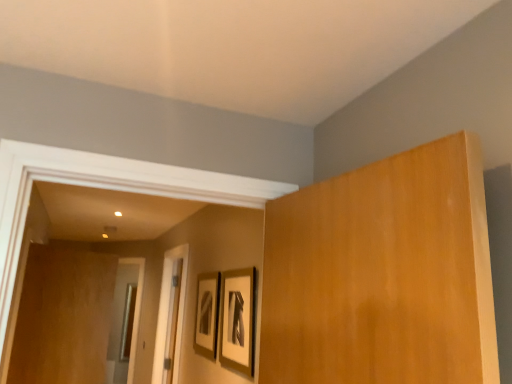
Question: Is matte black picture frame at center, the 2th picture frame when ordered from right to left, surrounded by brown wood door at left?

Choices:
 (A) yes
 (B) no

Answer: (B)

Question: Considering the relative positions of brown wood door at left and matte black picture frame at center, the 2th picture frame when ordered from right to left, in the image provided, is brown wood door at left to the left of matte black picture frame at center, the 2th picture frame when ordered from right to left, from the viewer's perspective?

Choices:
 (A) no
 (B) yes

Answer: (B)

Question: Can you confirm if brown wood door at left is positioned to the right of matte black picture frame at center, marked as the 2th picture frame in a front-to-back arrangement?

Choices:
 (A) no
 (B) yes

Answer: (A)

Question: Is matte black picture frame at center, the first picture frame viewed from the back, at the back of brown wood door at left?

Choices:
 (A) yes
 (B) no

Answer: (B)

Question: From a real-world perspective, is brown wood door at left on top of matte black picture frame at center, marked as the 2th picture frame in a front-to-back arrangement?

Choices:
 (A) no
 (B) yes

Answer: (A)

Question: Based on their positions, is matte black picture frame at center, the first picture frame in the left-to-right sequence, located to the left or right of matte black picture frame at center, positioned as the 1th picture frame in front-to-back order?

Choices:
 (A) right
 (B) left

Answer: (B)

Question: Is point (205, 349) closer or farther from the camera than point (230, 324)?

Choices:
 (A) closer
 (B) farther

Answer: (B)

Question: Looking at the image, does matte black picture frame at center, marked as the 2th picture frame in a front-to-back arrangement, seem bigger or smaller compared to matte black picture frame at center, the second picture frame viewed from the left?

Choices:
 (A) big
 (B) small

Answer: (B)

Question: Looking at their shapes, would you say matte black picture frame at center, the first picture frame in the left-to-right sequence, is wider or thinner than matte black picture frame at center, the second picture frame viewed from the left?

Choices:
 (A) wide
 (B) thin

Answer: (B)

Question: Considering the positions of point (28, 332) and point (238, 336), is point (28, 332) closer or farther from the camera than point (238, 336)?

Choices:
 (A) farther
 (B) closer

Answer: (A)

Question: From their relative heights in the image, would you say brown wood door at left is taller or shorter than matte black picture frame at center, the second picture frame viewed from the left?

Choices:
 (A) short
 (B) tall

Answer: (B)

Question: Which is correct: brown wood door at left is inside matte black picture frame at center, the second picture frame viewed from the left, or outside of it?

Choices:
 (A) inside
 (B) outside

Answer: (B)

Question: From a real-world perspective, is brown wood door at left above or below matte black picture frame at center, positioned as the 1th picture frame in front-to-back order?

Choices:
 (A) above
 (B) below

Answer: (B)

Question: From a real-world perspective, is matte black picture frame at center, the first picture frame viewed from the back, above or below brown wood door at left?

Choices:
 (A) below
 (B) above

Answer: (B)

Question: Is matte black picture frame at center, the first picture frame viewed from the back, situated inside brown wood door at left or outside?

Choices:
 (A) inside
 (B) outside

Answer: (B)